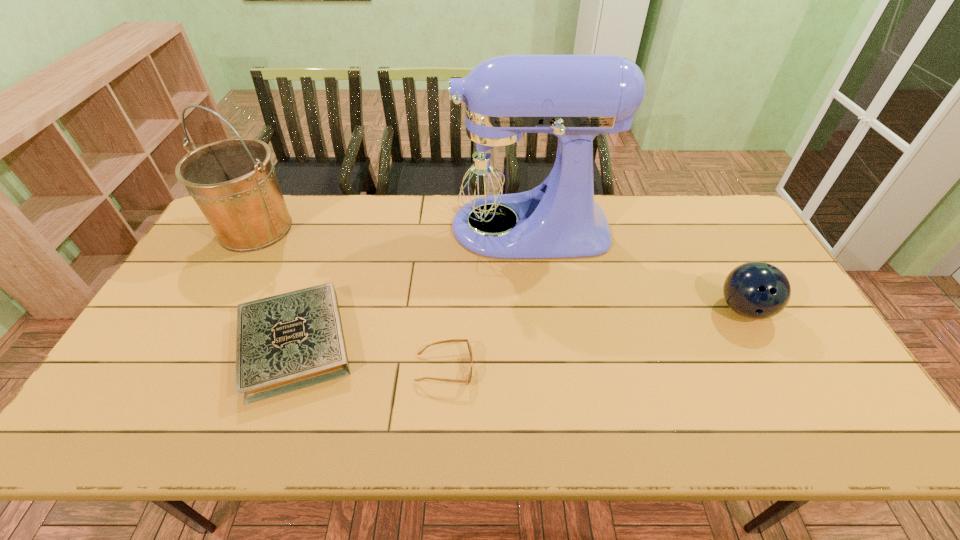
Locate an element on the screen. This screenshot has height=540, width=960. free location at the left edge is located at coordinates (173, 310).

I want to click on vacant space at the near right corner of the desktop, so click(861, 428).

Locate an element on the screen. Image resolution: width=960 pixels, height=540 pixels. vacant area between the second tallest object and the hardback book is located at coordinates (276, 286).

Where is `vacant region between the hardback book and the second tallest object`? This screenshot has width=960, height=540. vacant region between the hardback book and the second tallest object is located at coordinates (276, 286).

The width and height of the screenshot is (960, 540). I want to click on vacant area that lies between the hardback book and the bucket, so click(x=276, y=286).

Where is `free area in between the hardback book and the sunglasses`? This screenshot has height=540, width=960. free area in between the hardback book and the sunglasses is located at coordinates coord(370,356).

The height and width of the screenshot is (540, 960). Identify the location of vacant area between the mixer and the rightmost object. (634, 268).

This screenshot has height=540, width=960. What are the coordinates of `free space between the fourth shortest object and the mixer` in the screenshot? It's located at (390, 228).

Locate an element on the screen. free space between the fourth shortest object and the hardback book is located at coordinates (276, 286).

At what (x,y) coordinates should I click in order to perform the action: click on free space between the sunglasses and the rightmost object. Please return your answer as a coordinate pair (x, y). Looking at the image, I should click on (594, 339).